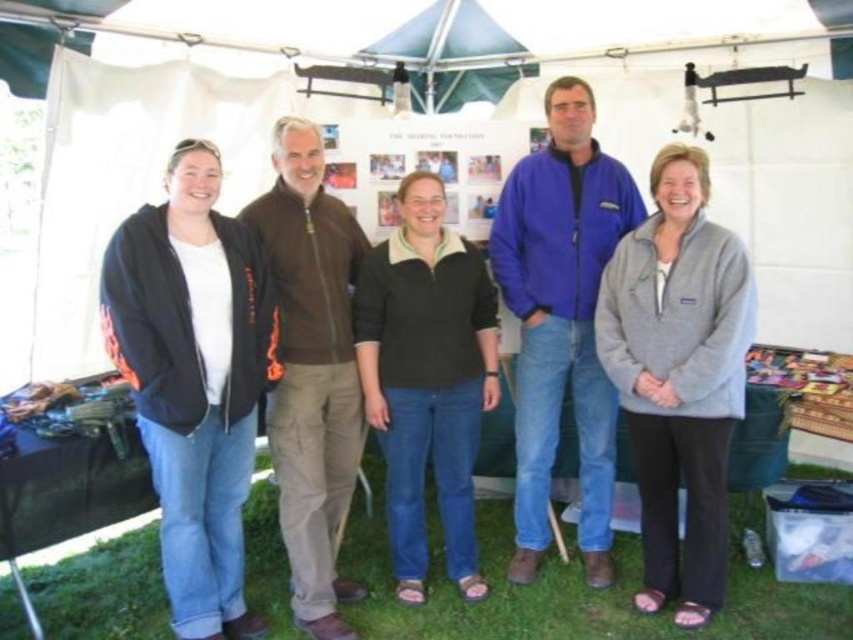
Question: Can you confirm if black fleece jacket at left is positioned above black fleece at center?

Choices:
 (A) yes
 (B) no

Answer: (B)

Question: Can you confirm if black fleece at center is positioned to the right of brown zip-up jacket at center?

Choices:
 (A) no
 (B) yes

Answer: (B)

Question: Which point is farther from the camera taking this photo?

Choices:
 (A) (403, 273)
 (B) (519, 538)

Answer: (B)

Question: Which of these objects is positioned farthest from the black fleece at center?

Choices:
 (A) brown zip-up jacket at center
 (B) gray fleece jacket at center

Answer: (B)

Question: Among these objects, which one is nearest to the camera?

Choices:
 (A) blue fabric canopy at upper center
 (B) black fleece at center
 (C) black fleece jacket at left
 (D) gray fleece jacket at center

Answer: (C)

Question: Can you confirm if black fleece at center is positioned below brown zip-up jacket at center?

Choices:
 (A) no
 (B) yes

Answer: (B)